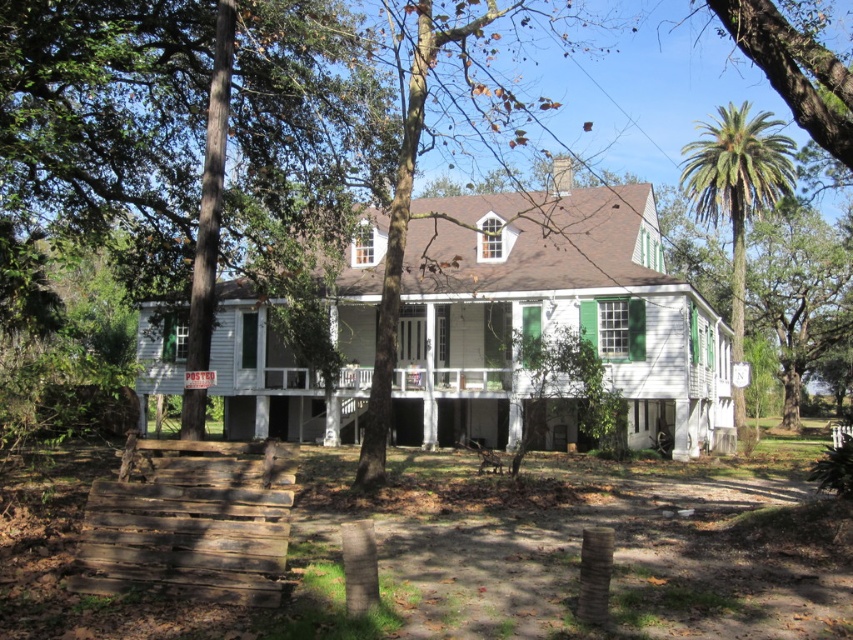
You are standing in front of the house and want to walk to the green wood tree at center. Which direction should you walk relative to the green leafy tree at left?

Since the green leafy tree at left is to the left of the green wood tree at center, you should walk to the right of the green leafy tree at left to reach the green wood tree at center.